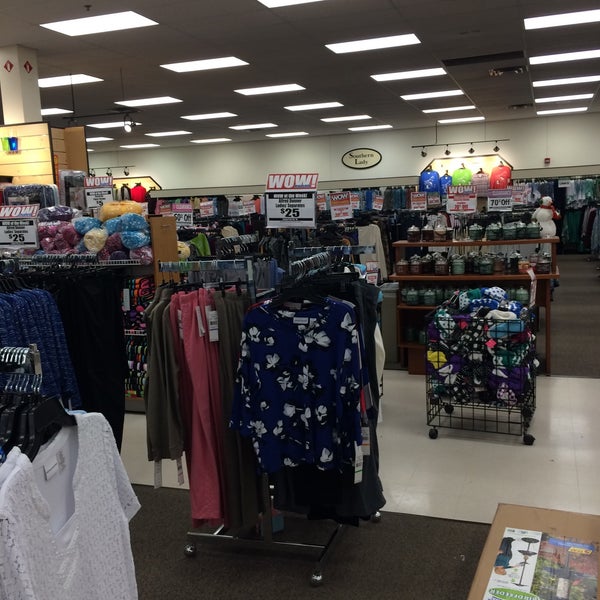
Where is `rack`? Image resolution: width=600 pixels, height=600 pixels. rack is located at coordinates (248, 263).